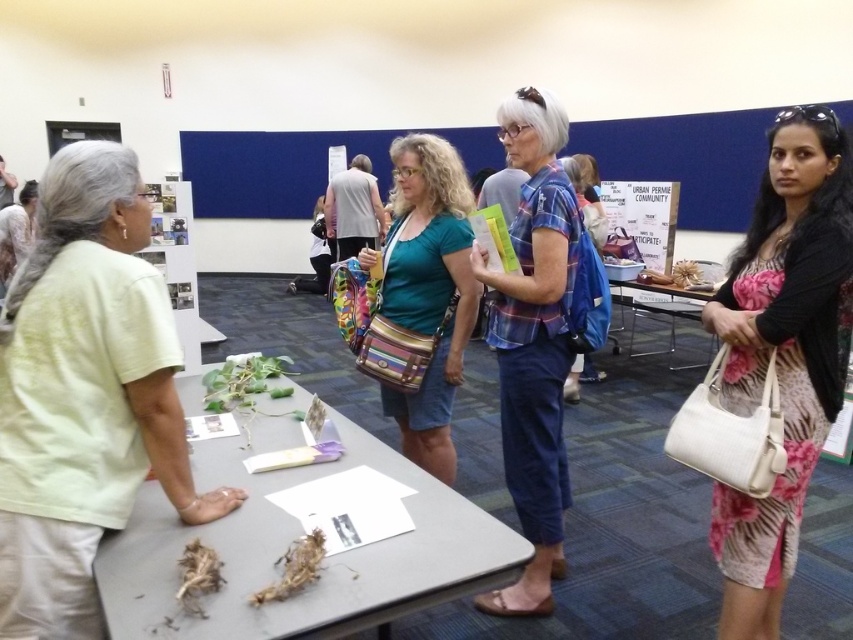
You are standing at the entrance of the room and see the pink floral dress at right and the metallic silver table at center. If you want to reach both, which one would you need to walk further to get to?

The pink floral dress at right is 3.48 meters away from the metallic silver table at center. Since you are at the entrance, the distance to each depends on their positions relative to the entrance. However, without specific entrance location details, we cannot definitively determine which requires walking further.

From the picture: You need to place a large poster on the table that requires a lot of space. Which table between the gray matte table at center and the metallic silver table at center would be more suitable?

The metallic silver table at center is more suitable because it occupies more space than the gray matte table at center, providing enough room for the large poster.

What is the location of the point with coordinates (782, 352) in the image?

The point with coordinates (782, 352) is located on the pink floral dress at right.